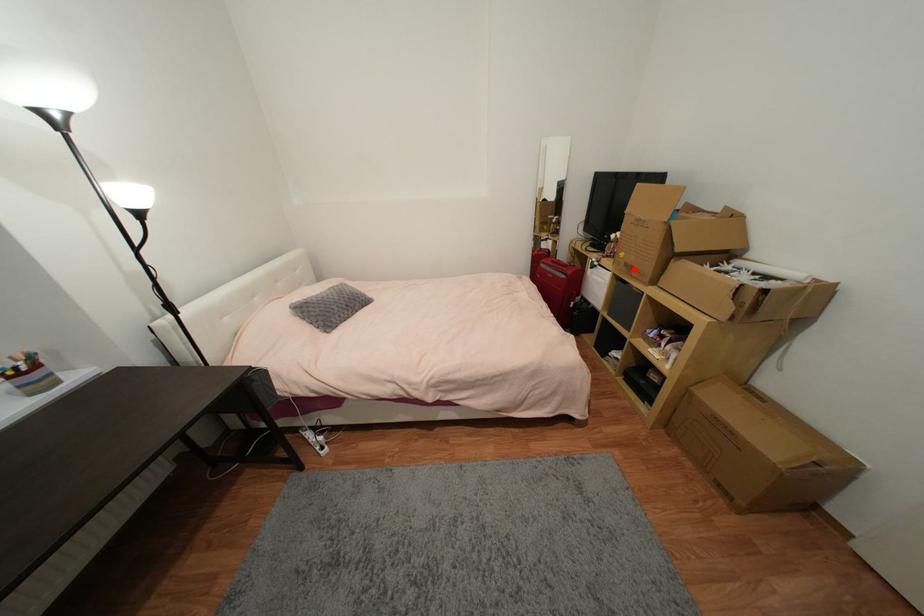
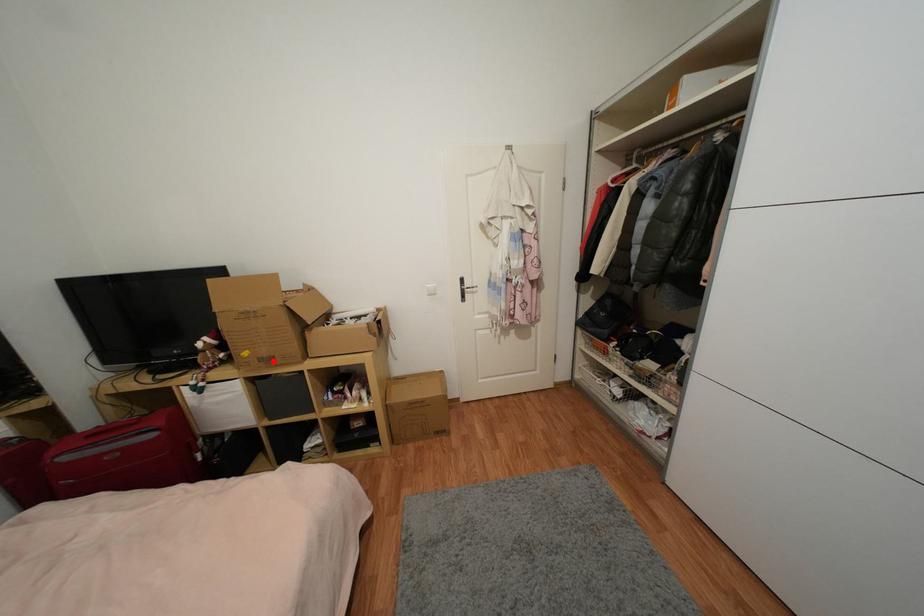
I am providing you with two images of the same scene from different viewpoints. A red point is marked on the first image and another point is marked on the second image. Is the marked point in image1 the same physical position as the marked point in image2?

Yes